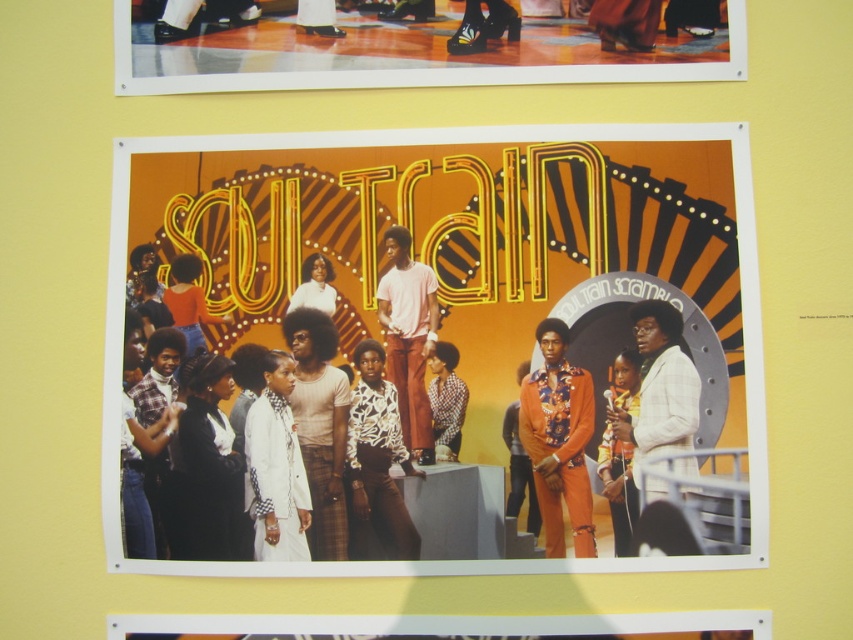
Does shiny metallic shoes at upper center have a greater height compared to orange velvet pants at center?

No.

The width and height of the screenshot is (853, 640). In order to click on shiny metallic shoes at upper center in this screenshot , I will do `click(422, 44)`.

Which is below, white printed shirt at center or white matte dress at center?

white printed shirt at center is below.

Does white printed shirt at center appear under white matte dress at center?

Yes, white printed shirt at center is below white matte dress at center.

Find the location of a particular element. This screenshot has width=853, height=640. white printed shirt at center is located at coordinates (376, 465).

Identify the location of white printed shirt at center. The height and width of the screenshot is (640, 853). (376, 465).

This screenshot has width=853, height=640. Find the location of `floral print pantsuit at center-right`. floral print pantsuit at center-right is located at coordinates (618, 486).

Can you confirm if floral print pantsuit at center-right is smaller than orange matte shirt at center?

Actually, floral print pantsuit at center-right might be larger than orange matte shirt at center.

Is point (612, 403) less distant than point (187, 324)?

Yes, point (612, 403) is closer to viewer.

In order to click on floral print pantsuit at center-right in this screenshot , I will do `click(618, 486)`.